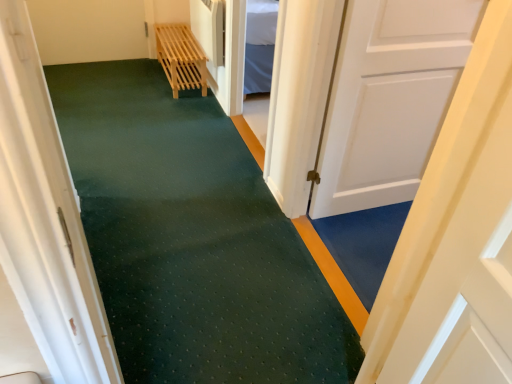
Question: Is light wood slatted bench at upper center wider or thinner than white matte door at right, which is the 2th door in left-to-right order?

Choices:
 (A) thin
 (B) wide

Answer: (B)

Question: Considering the positions of point (189, 81) and point (312, 210), is point (189, 81) closer or farther from the camera than point (312, 210)?

Choices:
 (A) farther
 (B) closer

Answer: (A)

Question: Based on their relative distances, which object is farther from the white matte door at right, which is the 2th door in left-to-right order?

Choices:
 (A) white matte door at center, the second door viewed from the right
 (B) light wood slatted bench at upper center

Answer: (B)

Question: Which of these objects is positioned farthest from the white matte door at center, the second door viewed from the right?

Choices:
 (A) white matte door at right, which appears as the first door when viewed from the right
 (B) light wood slatted bench at upper center

Answer: (B)